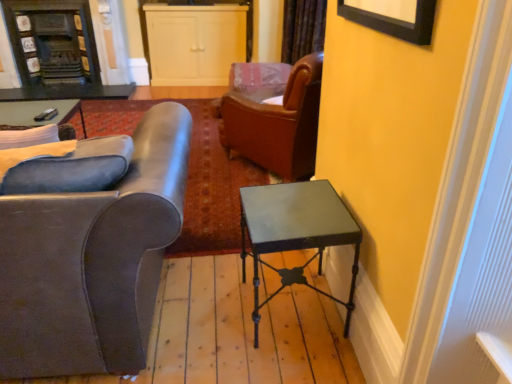
The image size is (512, 384). What do you see at coordinates (303, 28) in the screenshot?
I see `velvet brown curtain at upper center` at bounding box center [303, 28].

Measure the distance between point (40, 115) and camera.

The distance of point (40, 115) from camera is 11.98 feet.

Find the location of a particular element. matte black remote control at upper left is located at coordinates (46, 115).

Locate an element on the screen. This screenshot has width=512, height=384. dark gray stone fireplace at upper left is located at coordinates (56, 43).

Where is `velvet brown curtain at upper center`? This screenshot has height=384, width=512. velvet brown curtain at upper center is located at coordinates (303, 28).

Relative to dark gray stone fireplace at upper left, is metallic green table at right in front or behind?

metallic green table at right is positioned closer to the viewer than dark gray stone fireplace at upper left.

Can you confirm if metallic green table at right is bigger than dark gray stone fireplace at upper left?

No.

Is metallic green table at right looking in the opposite direction of dark gray stone fireplace at upper left?

metallic green table at right does not have its back to dark gray stone fireplace at upper left.

Looking at this image, is metallic green table at right with dark gray stone fireplace at upper left?

No, metallic green table at right is not with dark gray stone fireplace at upper left.

Is the position of dark wood fireplace at upper left, which is counted as the first cabinetry, starting from the left, more distant than that of metallic green table at right?

Yes, dark wood fireplace at upper left, which is counted as the first cabinetry, starting from the left, is further from the viewer.

Looking at their sizes, would you say dark wood fireplace at upper left, which is counted as the first cabinetry, starting from the left, is wider or thinner than metallic green table at right?

Considering their sizes, dark wood fireplace at upper left, which is counted as the first cabinetry, starting from the left, looks slimmer than metallic green table at right.

Who is shorter, dark wood fireplace at upper left, placed as the second cabinetry when sorted from right to left, or metallic green table at right?

metallic green table at right.

Identify the location of desk below the velvet brown curtain at upper center (from a real-world perspective). (296, 232).

What's the angular difference between metallic green table at right and velvet brown curtain at upper center's facing directions?

They differ by 43.1 degrees in their facing directions.

Can you see metallic green table at right touching velvet brown curtain at upper center?

No, metallic green table at right is not with velvet brown curtain at upper center.

How much distance is there between metallic green table at right and velvet brown curtain at upper center?

The distance of metallic green table at right from velvet brown curtain at upper center is 9.69 feet.

Considering the points (45, 209) and (57, 114), which point is in front, point (45, 209) or point (57, 114)?

Point (45, 209)

Does matte gray leather armchair at left have a lesser width compared to matte black remote control at upper left?

In fact, matte gray leather armchair at left might be wider than matte black remote control at upper left.

Considering the relative sizes of matte gray leather armchair at left and matte black remote control at upper left in the image provided, is matte gray leather armchair at left shorter than matte black remote control at upper left?

No, matte gray leather armchair at left is not shorter than matte black remote control at upper left.

Is the surface of matte gray leather armchair at left in direct contact with matte black remote control at upper left?

matte gray leather armchair at left is not next to matte black remote control at upper left, and they're not touching.

How far apart are matte black remote control at upper left and metallic green table at right?

matte black remote control at upper left and metallic green table at right are 6.68 feet apart from each other.

Does point (40, 114) lie in front of point (276, 236)?

No, it is behind (276, 236).

Considering the relative sizes of matte black remote control at upper left and metallic green table at right in the image provided, is matte black remote control at upper left wider than metallic green table at right?

In fact, matte black remote control at upper left might be narrower than metallic green table at right.

Between matte black remote control at upper left and metallic green table at right, which one has more height?

With more height is metallic green table at right.

You are a GUI agent. You are given a task and a screenshot of the screen. Output one action in this format:
    pyautogui.click(x=<x>, y=<y>)
    Task: Click on the curtain on the right of matte gray leather armchair at left
    This screenshot has height=384, width=512.
    Given the screenshot: What is the action you would take?
    pyautogui.click(x=303, y=28)

Considering the positions of point (111, 327) and point (311, 52), is point (111, 327) closer or farther from the camera than point (311, 52)?

Point (111, 327) appears to be closer to the viewer than point (311, 52).

Which of these two, matte gray leather armchair at left or velvet brown curtain at upper center, is smaller?

Smaller between the two is velvet brown curtain at upper center.

Is matte gray leather armchair at left further to camera compared to velvet brown curtain at upper center?

No, matte gray leather armchair at left is closer to the camera.

Does point (95, 75) appear closer or farther from the camera than point (97, 364)?

Point (95, 75) is positioned farther from the camera compared to point (97, 364).

Which of these two, dark gray stone fireplace at upper left or matte gray leather armchair at left, stands taller?

matte gray leather armchair at left is taller.

Between dark gray stone fireplace at upper left and matte gray leather armchair at left, which one has larger size?

matte gray leather armchair at left is bigger.

Considering their positions, is dark gray stone fireplace at upper left located in front of or behind matte gray leather armchair at left?

Clearly, dark gray stone fireplace at upper left is behind matte gray leather armchair at left.

Where is `fireplace above the metallic green table at right (from a real-world perspective)`? This screenshot has width=512, height=384. fireplace above the metallic green table at right (from a real-world perspective) is located at coordinates (56, 43).

Starting from the metallic green table at right, which cabinetry is the 2nd one to the left? Please provide its 2D coordinates.

[(60, 52)]

From the image, which object appears to be farther from velvet brown curtain at upper center, white matte cabinet at upper center, arranged as the 1th cabinetry when viewed from the right, or dark gray stone fireplace at upper left?

dark gray stone fireplace at upper left.

Based on their spatial positions, is white matte cabinet at upper center, the second cabinetry when ordered from left to right, or matte black remote control at upper left further from velvet brown curtain at upper center?

The object further to velvet brown curtain at upper center is matte black remote control at upper left.

Considering their positions, is velvet brown curtain at upper center positioned closer to dark gray stone fireplace at upper left than white matte cabinet at upper center, the second cabinetry when ordered from left to right?

white matte cabinet at upper center, the second cabinetry when ordered from left to right.

Based on their spatial positions, is white matte cabinet at upper center, the second cabinetry when ordered from left to right, or matte black remote control at upper left further from dark wood fireplace at upper left, which is counted as the first cabinetry, starting from the left?

matte black remote control at upper left is positioned further to the anchor dark wood fireplace at upper left, which is counted as the first cabinetry, starting from the left.

Based on the photo, considering their positions, is white matte cabinet at upper center, the second cabinetry when ordered from left to right, positioned further to matte gray leather armchair at left than dark gray stone fireplace at upper left?

The object further to matte gray leather armchair at left is dark gray stone fireplace at upper left.

When comparing their distances from matte gray leather armchair at left, does matte black remote control at upper left or dark gray stone fireplace at upper left seem closer?

The object closer to matte gray leather armchair at left is matte black remote control at upper left.

Estimate the real-world distances between objects in this image. Which object is closer to dark gray stone fireplace at upper left, matte black remote control at upper left or velvet brown curtain at upper center?

Based on the image, matte black remote control at upper left appears to be nearer to dark gray stone fireplace at upper left.

When comparing their distances from velvet brown curtain at upper center, does dark wood fireplace at upper left, placed as the second cabinetry when sorted from right to left, or dark gray stone fireplace at upper left seem closer?

Based on the image, dark wood fireplace at upper left, placed as the second cabinetry when sorted from right to left, appears to be nearer to velvet brown curtain at upper center.

Locate an element on the screen. This screenshot has width=512, height=384. curtain positioned between matte black remote control at upper left and white matte cabinet at upper center, arranged as the 1th cabinetry when viewed from the right, from near to far is located at coordinates (303, 28).

Where is `curtain positioned between matte gray leather armchair at left and dark gray stone fireplace at upper left from near to far`? This screenshot has width=512, height=384. curtain positioned between matte gray leather armchair at left and dark gray stone fireplace at upper left from near to far is located at coordinates (303, 28).

The height and width of the screenshot is (384, 512). I want to click on remote control located between matte gray leather armchair at left and dark gray stone fireplace at upper left in the depth direction, so click(x=46, y=115).

This screenshot has width=512, height=384. Find the location of `curtain between metallic green table at right and dark wood fireplace at upper left, placed as the second cabinetry when sorted from right to left, in the front-back direction`. curtain between metallic green table at right and dark wood fireplace at upper left, placed as the second cabinetry when sorted from right to left, in the front-back direction is located at coordinates coord(303,28).